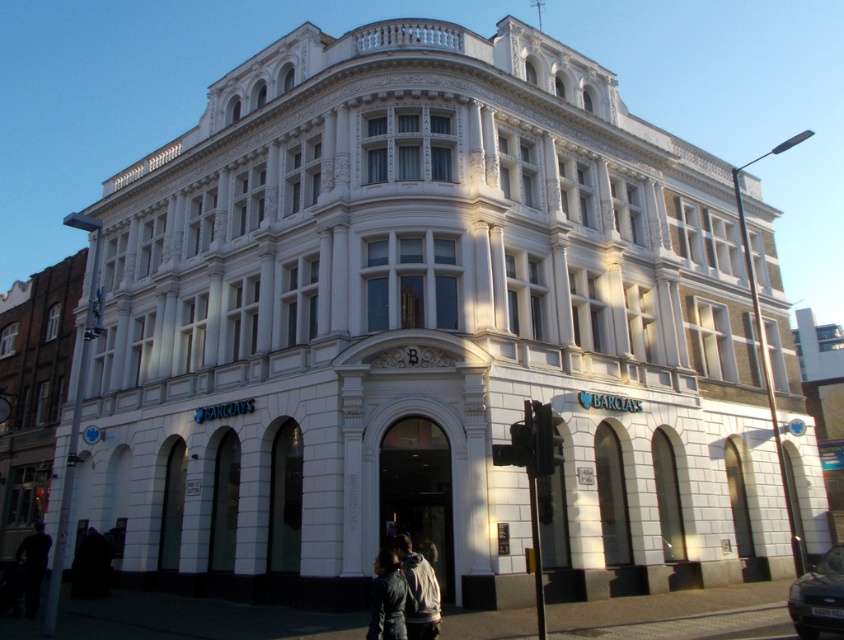
Is metallic silver car at lower right above white textured jacket at lower center?

Incorrect, metallic silver car at lower right is not positioned above white textured jacket at lower center.

Which is behind, point (805, 637) or point (426, 563)?

Point (805, 637)

Where is `metallic silver car at lower right`? metallic silver car at lower right is located at coordinates (818, 596).

Where is `leather jacket at center`? leather jacket at center is located at coordinates (387, 598).

Does leather jacket at center appear over dark fabric jacket at lower left?

Indeed, leather jacket at center is positioned over dark fabric jacket at lower left.

Is point (383, 554) closer to viewer compared to point (42, 529)?

Yes, it is in front of point (42, 529).

This screenshot has width=844, height=640. Find the location of `leather jacket at center`. leather jacket at center is located at coordinates (387, 598).

Which of these two, metallic silver car at lower right or dark fabric jacket at lower left, stands shorter?

With less height is metallic silver car at lower right.

I want to click on metallic silver car at lower right, so click(818, 596).

In order to click on metallic silver car at lower right in this screenshot , I will do `click(818, 596)`.